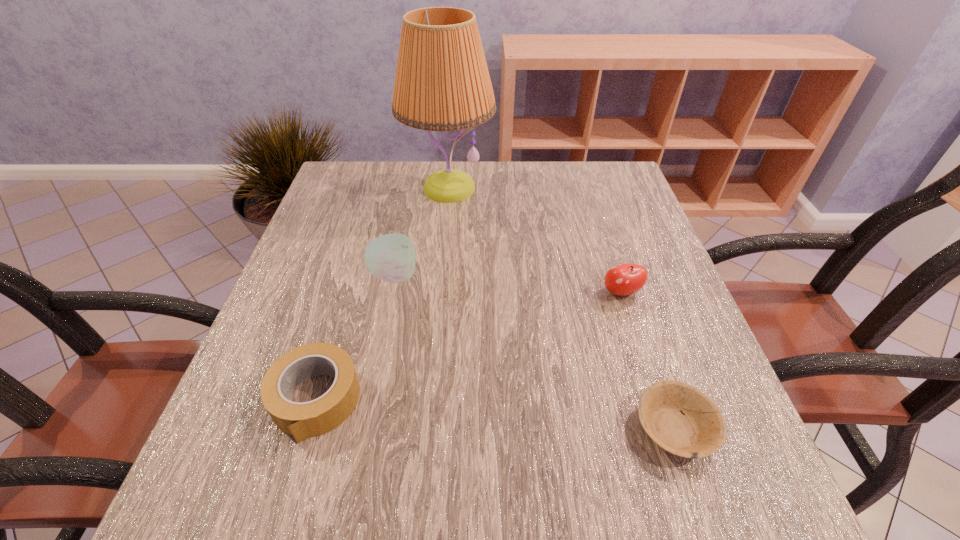
Where is `blank region between the duct tape and the shorter apple`? blank region between the duct tape and the shorter apple is located at coordinates (468, 346).

This screenshot has height=540, width=960. I want to click on empty space between the right apple and the tallest object, so click(535, 240).

The height and width of the screenshot is (540, 960). What are the coordinates of `free area in between the duct tape and the fourth shortest object` in the screenshot? It's located at (355, 338).

This screenshot has height=540, width=960. I want to click on free space between the duct tape and the shorter apple, so click(468, 346).

The height and width of the screenshot is (540, 960). What are the coordinates of `object that is the fourth closest to the farthest object` in the screenshot? It's located at (698, 431).

Choose which object is the nearest neighbor to the duct tape. Please provide its 2D coordinates. Your answer should be formatted as a tuple, i.e. [(x, y)], where the tuple contains the x and y coordinates of a point satisfying the conditions above.

[(391, 257)]

Find the location of `free point that satisfies the following two spatial constraints: 1. at the edge of the bowl; 2. on the left side of the second shortest object`. free point that satisfies the following two spatial constraints: 1. at the edge of the bowl; 2. on the left side of the second shortest object is located at coordinates (307, 428).

This screenshot has width=960, height=540. Find the location of `vacant space that satisfies the following two spatial constraints: 1. at the edge of the shortest object; 2. on the left side of the duct tape`. vacant space that satisfies the following two spatial constraints: 1. at the edge of the shortest object; 2. on the left side of the duct tape is located at coordinates (307, 428).

This screenshot has height=540, width=960. Identify the location of free space that satisfies the following two spatial constraints: 1. on the front side of the bowl; 2. on the left side of the fourth shortest object. tap(364, 428).

The height and width of the screenshot is (540, 960). In order to click on vacant space that satisfies the following two spatial constraints: 1. at the edge of the shortest object; 2. on the left side of the duct tape in this screenshot , I will do `click(307, 428)`.